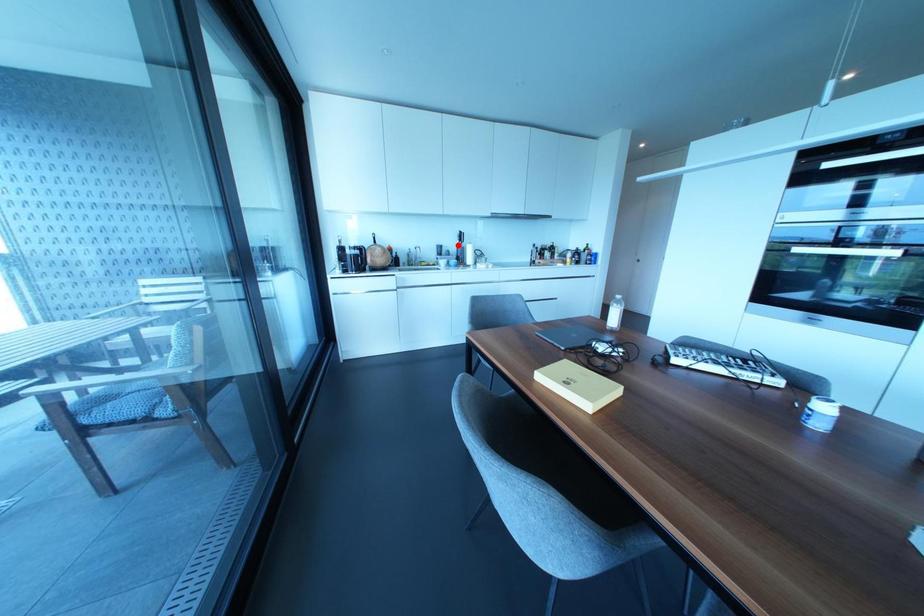
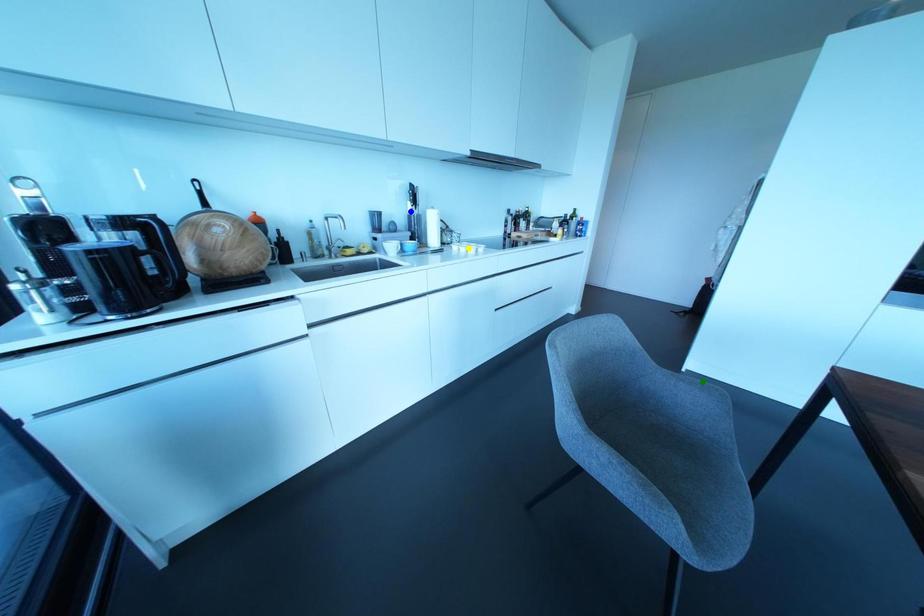
Question: I am providing you with two images of the same scene from different viewpoints. A red point is marked on the first image. You are given multiple points on the second image. Which point in image 2 represents the same 3d spot as the red point in image 1?

Choices:
 (A) green point
 (B) yellow point
 (C) blue point

Answer: (C)